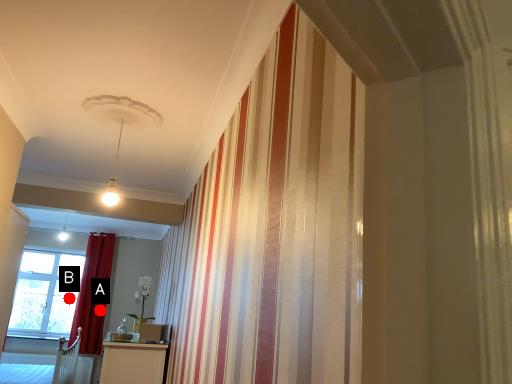
Question: Two points are circled on the image, labeled by A and B beside each circle. Among these points, which one is farthest from the camera?

Choices:
 (A) A is further
 (B) B is further

Answer: (B)